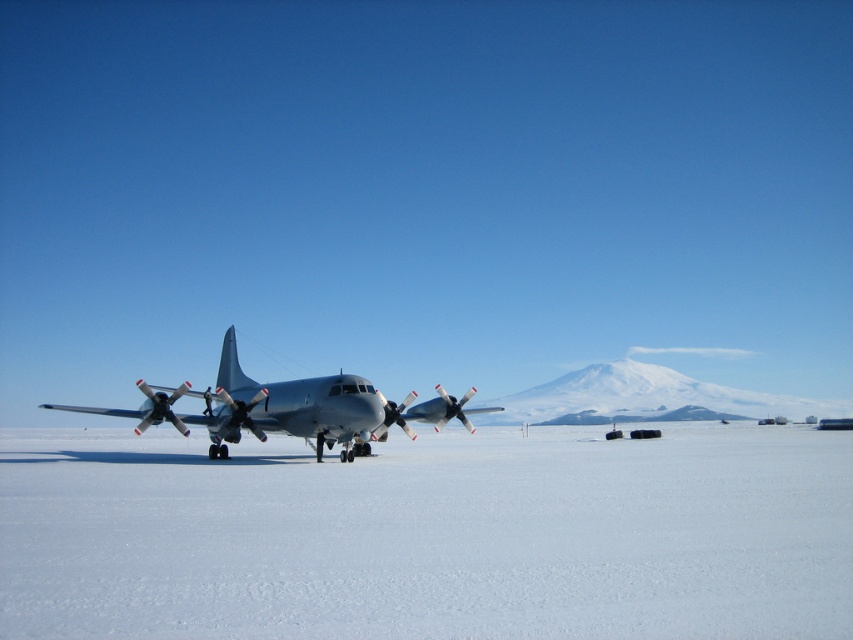
You are a pilot preparing to land a small aircraft on the snow near the point marked at coordinates (428,536). Based on the scene description, what is the condition of the landing area at that point?

The point at coordinates (428,536) indicates white smooth snow at center, so the landing area there is smooth and suitable for landing.